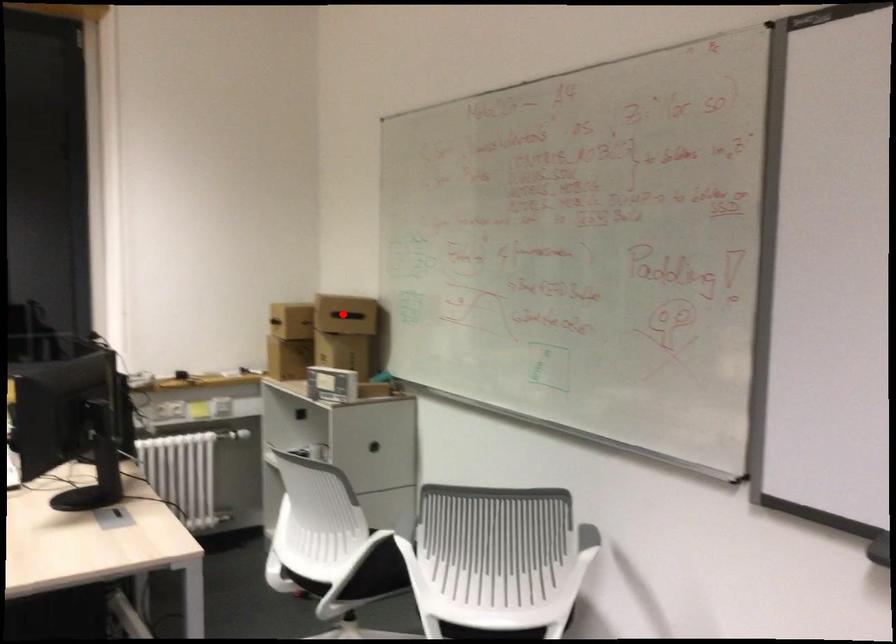
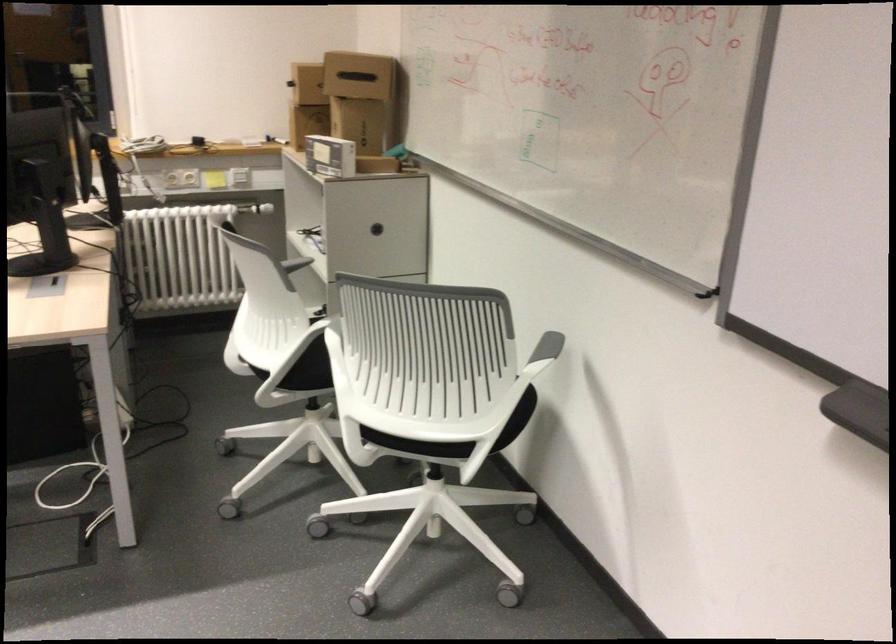
Question: I am providing you with two images of the same scene from different viewpoints. In image1, a red point is highlighted. Considering the same 3D point in image2, which of the following is correct?

Choices:
 (A) It is closer
 (B) It is farther

Answer: (A)